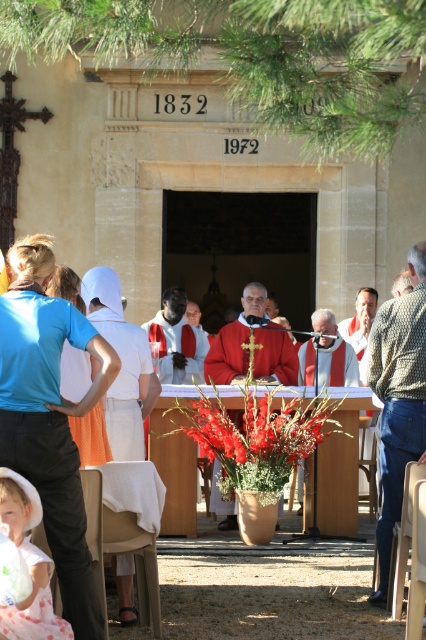
You are attending the ceremony and need to hand a document to the person wearing the white cotton robe at left and the matte red vest at center. Which person is closer to you so you can approach them first?

The white cotton robe at left is closer to the viewer than the matte red vest at center, so you should approach the person wearing the white cotton robe at left first.

You are an event planner setting up for a ceremony. You need to ensure the shiny metallic vase at center is visible to all attendees. Considering the white cotton robe at left is in the way, how might you adjust their positions?

The shiny metallic vase at center is shorter than the white cotton robe at left, so moving the vase slightly forward or to the side could help make it more visible by positioning it in front of or beside the robe.

You are attending this religious ceremony and notice two garments on the table. The white cotton robe at left and the matte red vest at center. Which one is larger in size?

The matte red vest at center is larger than the white cotton robe at left.